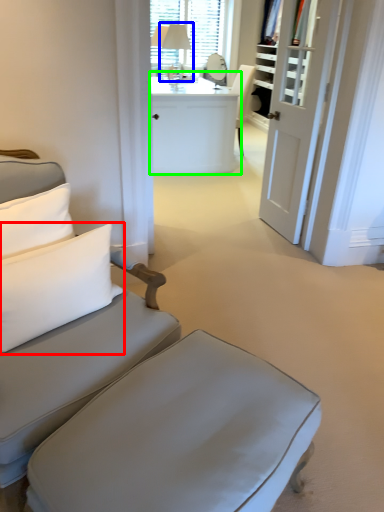
Question: Which object is the farthest from pillow (highlighted by a red box)? Choose among these: table lamp (highlighted by a blue box) or desk (highlighted by a green box).

Choices:
 (A) table lamp
 (B) desk

Answer: (A)